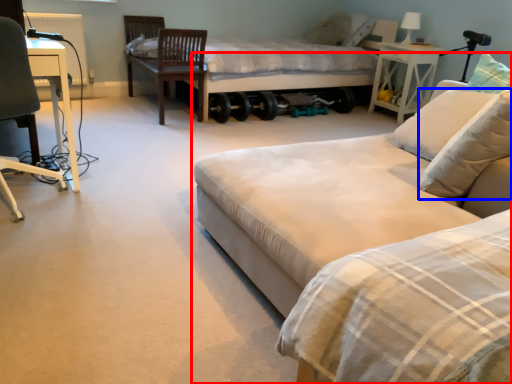
Question: Which point is further to the camera, bed (highlighted by a red box) or pillow (highlighted by a blue box)?

Choices:
 (A) bed
 (B) pillow

Answer: (B)